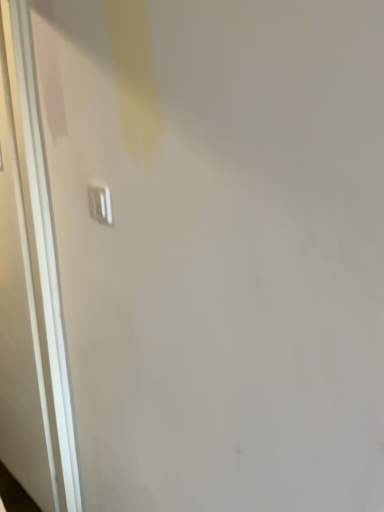
Question: From a real-world perspective, is white glossy door at left on white plastic light switch at upper left?

Choices:
 (A) yes
 (B) no

Answer: (B)

Question: Considering the relative sizes of white glossy door at left and white plastic light switch at upper left in the image provided, is white glossy door at left bigger than white plastic light switch at upper left?

Choices:
 (A) yes
 (B) no

Answer: (A)

Question: Does white glossy door at left touch white plastic light switch at upper left?

Choices:
 (A) yes
 (B) no

Answer: (B)

Question: Is white glossy door at left facing towards white plastic light switch at upper left?

Choices:
 (A) no
 (B) yes

Answer: (A)

Question: Considering the relative sizes of white glossy door at left and white plastic light switch at upper left in the image provided, is white glossy door at left taller than white plastic light switch at upper left?

Choices:
 (A) no
 (B) yes

Answer: (B)

Question: Are white glossy door at left and white plastic light switch at upper left located far from each other?

Choices:
 (A) no
 (B) yes

Answer: (A)

Question: Can you confirm if white plastic light switch at upper left is wider than white glossy door at left?

Choices:
 (A) yes
 (B) no

Answer: (B)

Question: Is white plastic light switch at upper left further to camera compared to white glossy door at left?

Choices:
 (A) yes
 (B) no

Answer: (B)

Question: Is white glossy door at left located within white plastic light switch at upper left?

Choices:
 (A) yes
 (B) no

Answer: (B)

Question: From the image's perspective, would you say white plastic light switch at upper left is shown under white glossy door at left?

Choices:
 (A) yes
 (B) no

Answer: (B)

Question: Is white plastic light switch at upper left to the right of white glossy door at left from the viewer's perspective?

Choices:
 (A) no
 (B) yes

Answer: (B)

Question: Does white plastic light switch at upper left have a lesser height compared to white glossy door at left?

Choices:
 (A) yes
 (B) no

Answer: (A)

Question: Would you say white glossy door at left is to the left or to the right of white plastic light switch at upper left in the picture?

Choices:
 (A) left
 (B) right

Answer: (A)